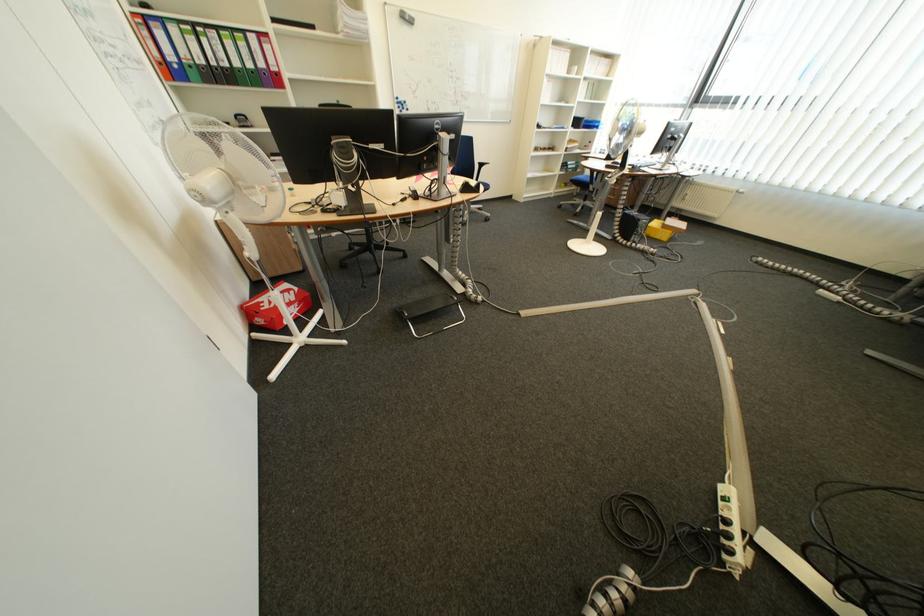
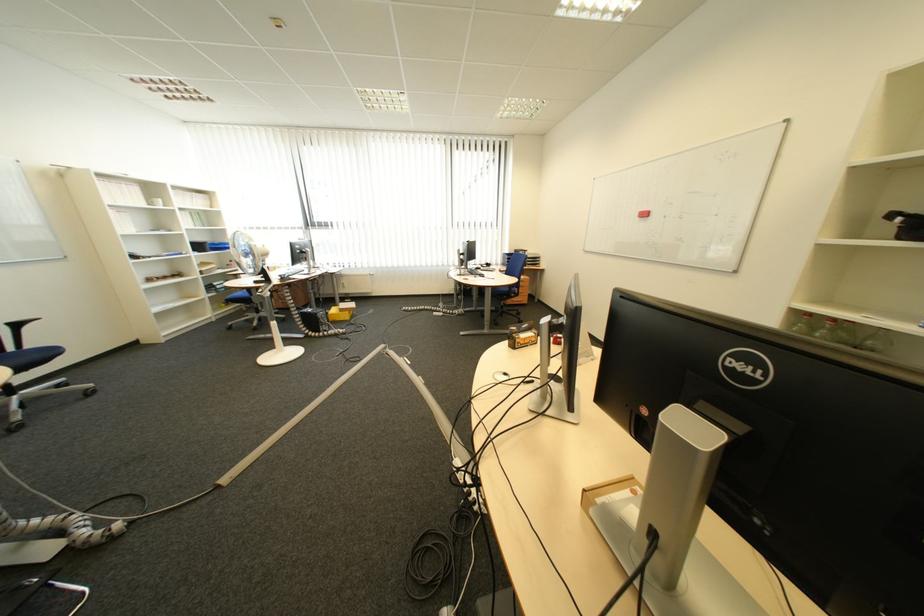
The point at (491,161) is marked in the first image. Where is the corresponding point in the second image?

(13, 321)